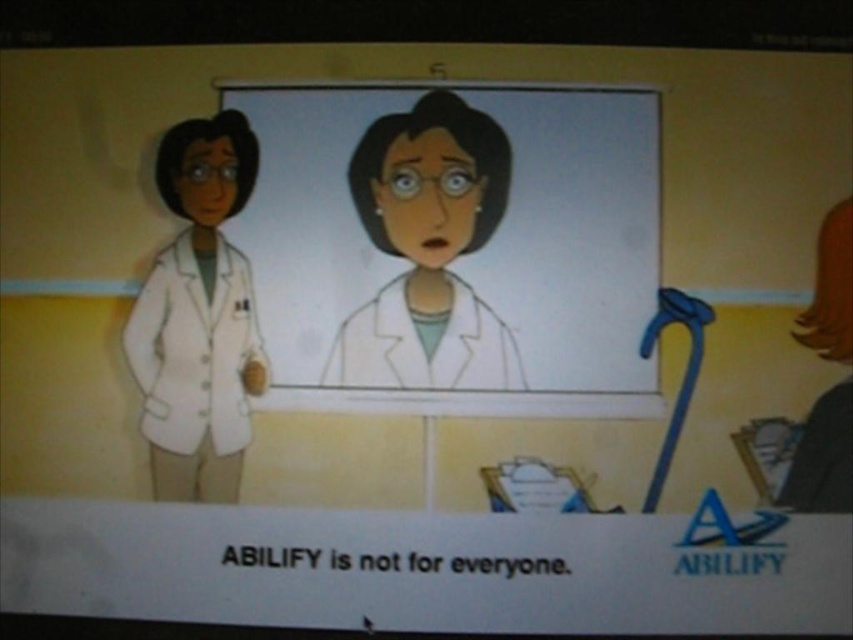
You are a medical student observing the scene. You notice a point at coordinates [428,252]. What object is located at this point?

The point at coordinates [428,252] corresponds to the matte white coat at center.

You are a medical student observing two doctors in the office. You notice both are wearing coats. Which coat has a greater width, the white lab coat at center or the matte white coat at center?

The white lab coat at center has a greater width than the matte white coat at center according to the description.

You are a medical student who needs to place a 25 cm wide medical textbook between the two doctors wearing the matte white coat at center and the white matte lab coat at left. Will the textbook fit in the space between them?

The distance between the matte white coat at center and the white matte lab coat at left is 26.41 centimeters. Since the textbook is 25 cm wide, it will fit in the space between them.